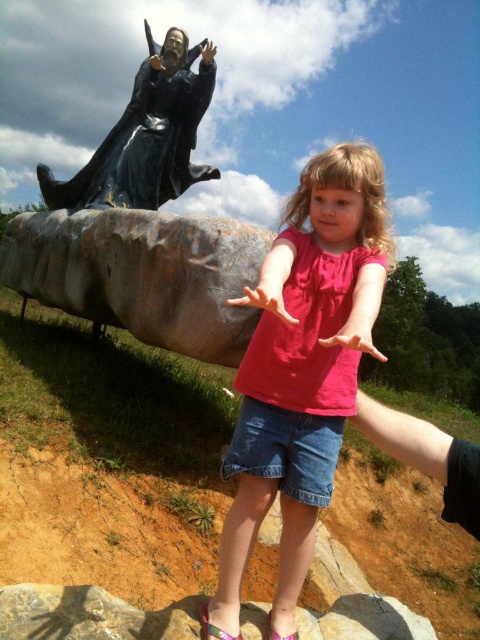
Between pink matte hand at center and black matte hand at upper center, which one has more height?

Standing taller between the two is black matte hand at upper center.

What do you see at coordinates (265, 298) in the screenshot? I see `pink matte hand at center` at bounding box center [265, 298].

Identify the location of pink matte hand at center. The width and height of the screenshot is (480, 640). (265, 298).

What do you see at coordinates (265, 298) in the screenshot? The image size is (480, 640). I see `pink matte hand at center` at bounding box center [265, 298].

Is pink matte hand at center shorter than matte pink hand at center?

Yes, pink matte hand at center is shorter than matte pink hand at center.

This screenshot has height=640, width=480. Find the location of `pink matte hand at center`. pink matte hand at center is located at coordinates (265, 298).

Between point (134, 77) and point (204, 44), which one is positioned behind?

The point (134, 77) is more distant.

In the scene shown: Is black polished statue at upper left bigger than black matte hand at upper center?

No, black polished statue at upper left is not bigger than black matte hand at upper center.

Which is behind, point (163, 106) or point (207, 42)?

The point (163, 106) is more distant.

The height and width of the screenshot is (640, 480). I want to click on black polished statue at upper left, so click(x=145, y=136).